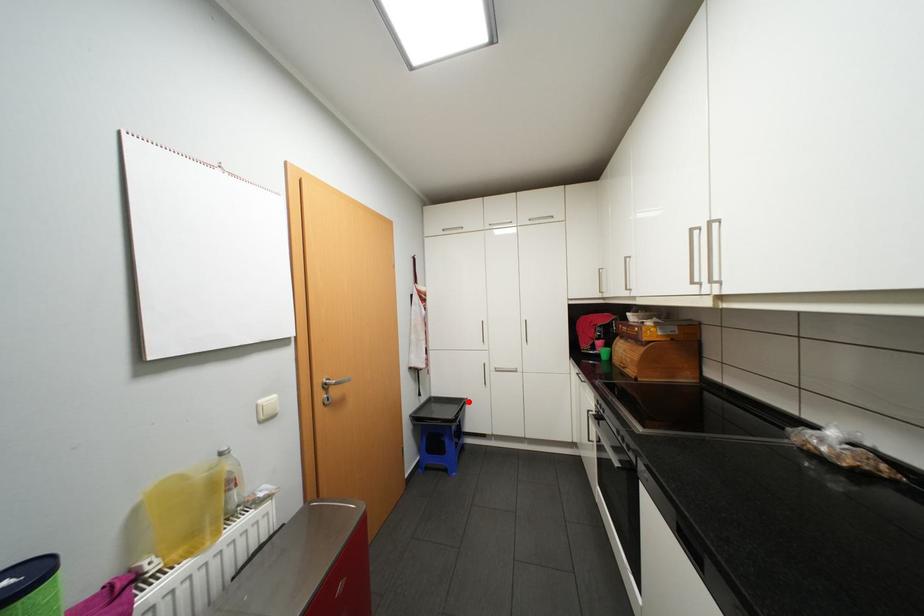
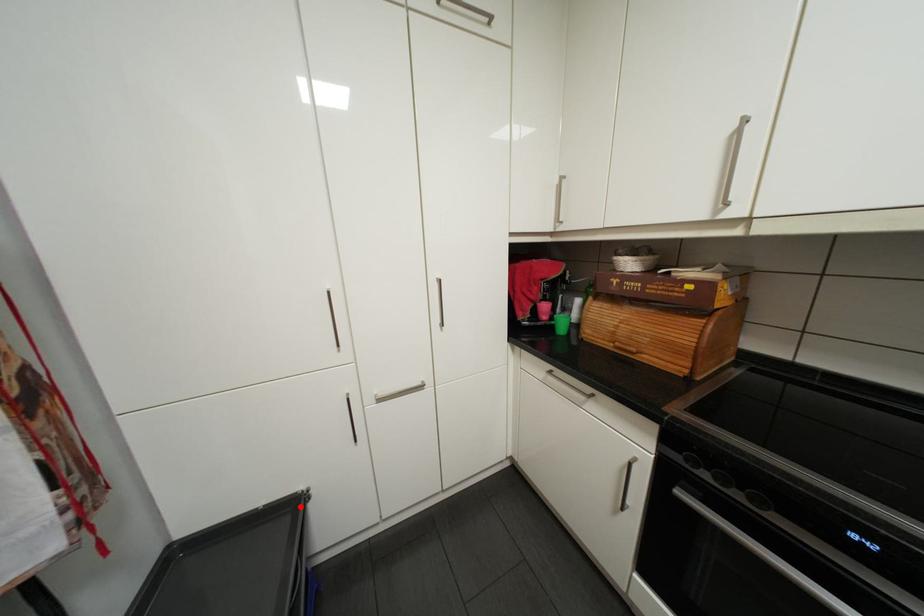
I am providing you with two images of the same scene from different viewpoints. A red point is marked on the first image and another point is marked on the second image. Is the marked point in image1 the same physical position as the marked point in image2?

Yes